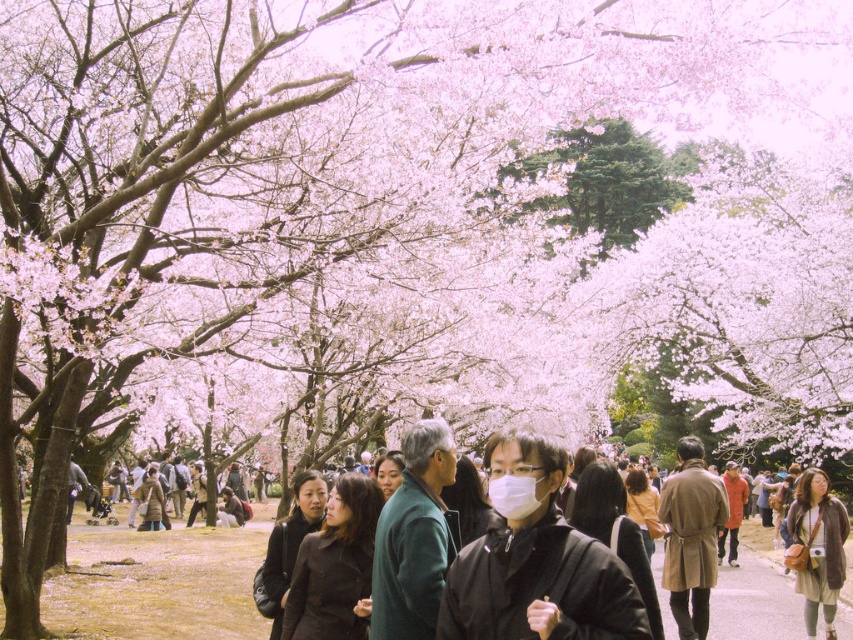
You are a photographer trying to capture both the green matte jacket at center and the brown leather jacket at lower right in a single frame. Given their sizes, which jacket will appear larger in the photo?

The brown leather jacket at lower right will appear larger in the photo since it has a bigger size than the green matte jacket at center.

You are standing at the point with coordinates point (x=450, y=476) and want to walk towards the point with coordinates point (x=564, y=625). Which direction should you move in?

You should move forward because point (x=564, y=625) is in front of point (x=450, y=476).